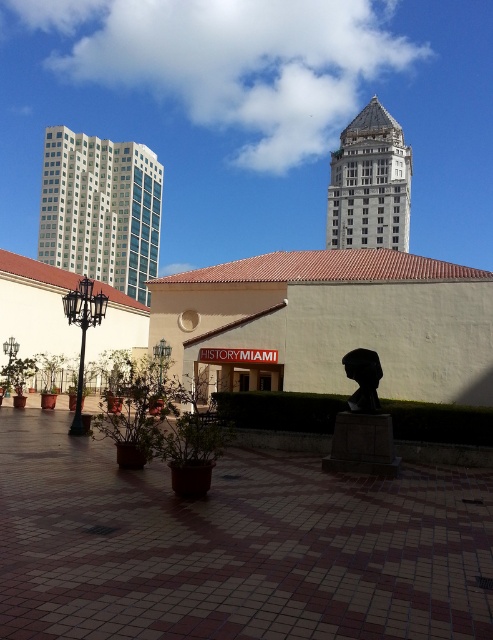
You are a photographer planning to capture the HISTORY MIAMI plaza. You notice the white glass building at upper left and the gray stone tower at upper center in your viewfinder. Which structure appears wider in the frame?

The white glass building at upper left appears wider than the gray stone tower at upper center because its width surpasses the tower.

You are standing at the entrance of HISTORY MIAMI and want to reach the point marked as point (105, 275). Given that your walking speed is 3 feet per second, how many seconds will it take you to reach that point?

The distance between you and point (105, 275) is 517.75 feet. At a speed of 3 feet per second, it would take 517.75 divided by 3, which equals approximately 172.58 seconds to reach the point.